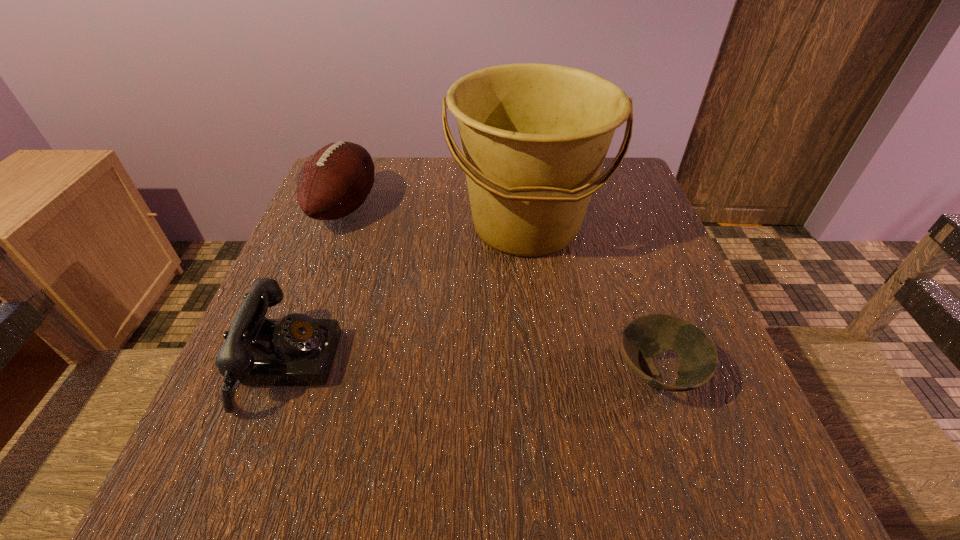
Locate an element on the screen. football (American) present at the left edge is located at coordinates (335, 181).

This screenshot has height=540, width=960. What are the coordinates of `telephone located in the left edge section of the desktop` in the screenshot? It's located at (297, 350).

The height and width of the screenshot is (540, 960). What are the coordinates of `bucket present at the right edge` in the screenshot? It's located at (534, 137).

You are a GUI agent. You are given a task and a screenshot of the screen. Output one action in this format:
    pyautogui.click(x=<x>, y=<y>)
    Task: Click on the bowl present at the right edge
    The width and height of the screenshot is (960, 540).
    Given the screenshot: What is the action you would take?
    (x=643, y=338)

This screenshot has height=540, width=960. I want to click on object that is at the far left corner, so (x=335, y=181).

Identify the location of object at the far right corner. (534, 137).

At what (x,y) coordinates should I click in order to perform the action: click on vacant space at the far edge of the desktop. Please return your answer as a coordinate pair (x, y). This screenshot has height=540, width=960. Looking at the image, I should click on (401, 202).

In the image, there is a desktop. Where is `vacant space at the near edge`? vacant space at the near edge is located at coordinates (493, 453).

Where is `vacant space at the right edge of the desktop`? The width and height of the screenshot is (960, 540). vacant space at the right edge of the desktop is located at coordinates (673, 273).

The height and width of the screenshot is (540, 960). What are the coordinates of `vacant point at the near left corner` in the screenshot? It's located at (191, 495).